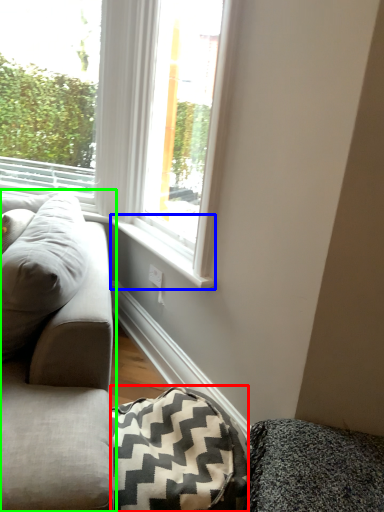
Question: Which is farther away from blanket (highlighted by a red box)? window sill (highlighted by a blue box) or studio couch (highlighted by a green box)?

Choices:
 (A) window sill
 (B) studio couch

Answer: (A)